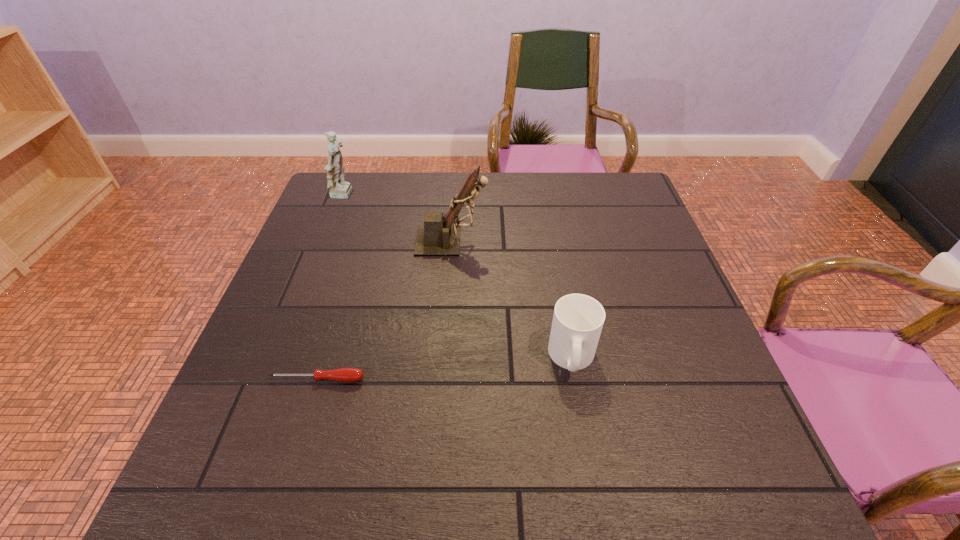
The height and width of the screenshot is (540, 960). In order to click on free space between the left figurine and the rightmost object in this screenshot , I will do `click(458, 276)`.

Select which object is the closest to the rightmost object. Please provide its 2D coordinates. Your answer should be formatted as a tuple, i.e. [(x, y)], where the tuple contains the x and y coordinates of a point satisfying the conditions above.

[(437, 237)]

The width and height of the screenshot is (960, 540). I want to click on the third closest object to the shortest object, so click(x=338, y=188).

Identify the location of free spot that satisfies the following two spatial constraints: 1. on the front-facing side of the farther figurine; 2. on the right side of the shortest object. This screenshot has height=540, width=960. (272, 379).